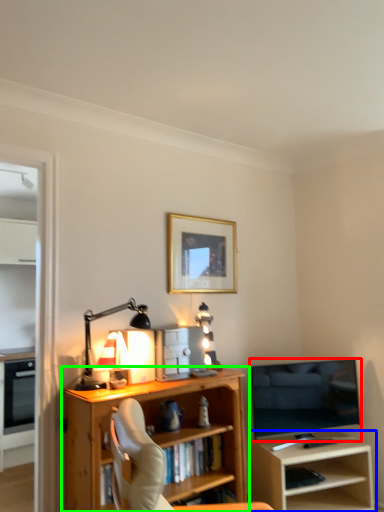
Question: Considering the real-world distances, which object is farthest from television (highlighted by a red box)? shelf (highlighted by a blue box) or bookcase (highlighted by a green box)?

Choices:
 (A) shelf
 (B) bookcase

Answer: (B)